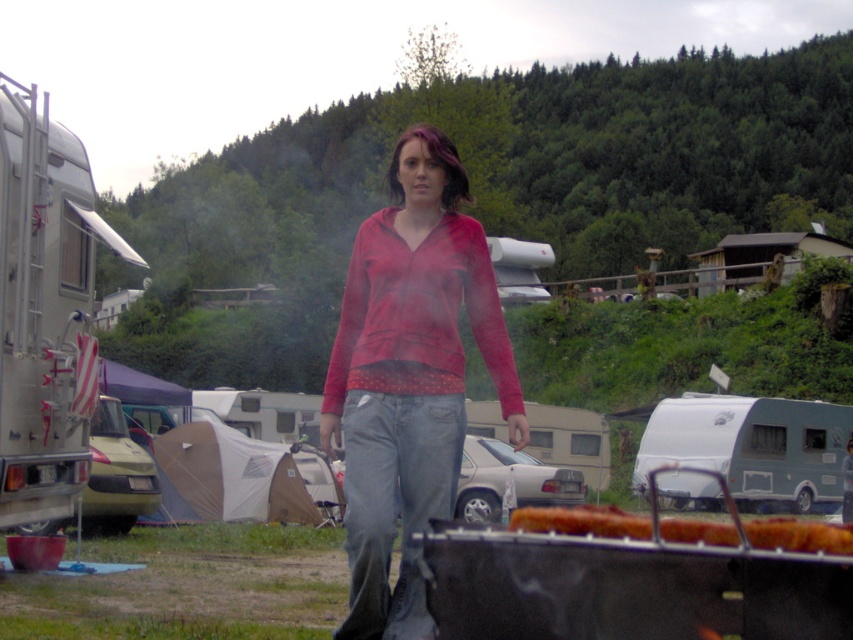
Question: Which is nearer to the tan canvas tent at lower left?

Choices:
 (A) golden crispy bread at lower center
 (B) green matte van at left
 (C) silver metallic trailer at left
 (D) matte red hoodie at center

Answer: (B)

Question: Estimate the real-world distances between objects in this image. Which object is farther from the green matte van at left?

Choices:
 (A) tan canvas tent at lower left
 (B) silver metallic trailer at left
 (C) matte red hoodie at center
 (D) silver metallic trailer at center

Answer: (C)

Question: In this image, where is golden crispy bread at lower center located relative to green matte van at left?

Choices:
 (A) above
 (B) below

Answer: (B)

Question: Can you confirm if silver metallic trailer at left is positioned to the right of silver metallic trailer at center?

Choices:
 (A) yes
 (B) no

Answer: (B)

Question: Which object is the farthest from the golden crispy bread at lower center?

Choices:
 (A) green matte van at left
 (B) silver metallic trailer at center

Answer: (A)

Question: Is silver metallic trailer at left further to camera compared to green matte van at left?

Choices:
 (A) yes
 (B) no

Answer: (B)